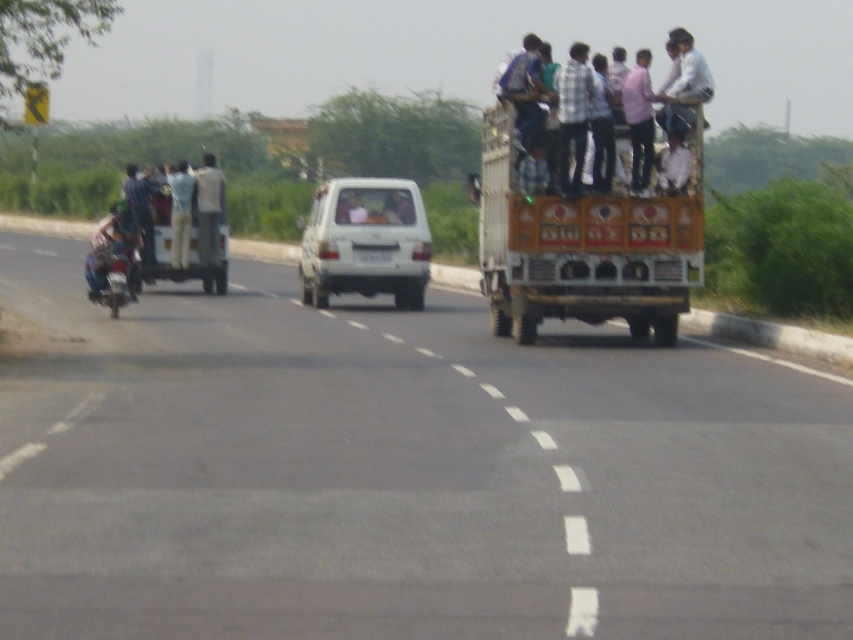
You are a pedestrian standing on the side of the road and see the pink shirt at upper center and the white glossy van at center. Which object is closer to the right edge of the road?

The pink shirt at upper center is positioned on the right side of the white glossy van at center, so it is closer to the right edge of the road.

You are a pedestrian standing on the side of the road. You see the painted wooden truck at center and the plaid fabric shirt at center. Which object is closer to the ground?

The painted wooden truck at center is positioned under the plaid fabric shirt at center, meaning it is closer to the ground.